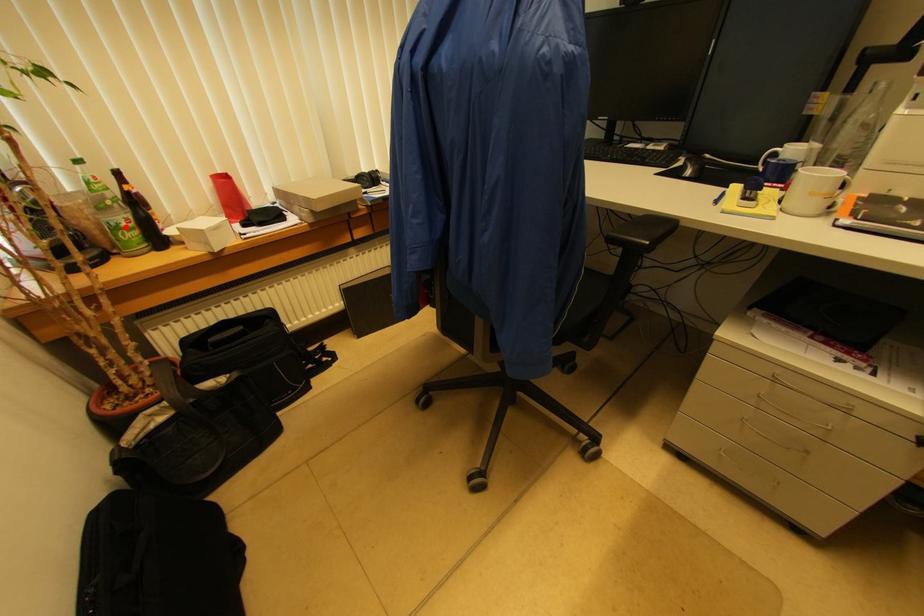
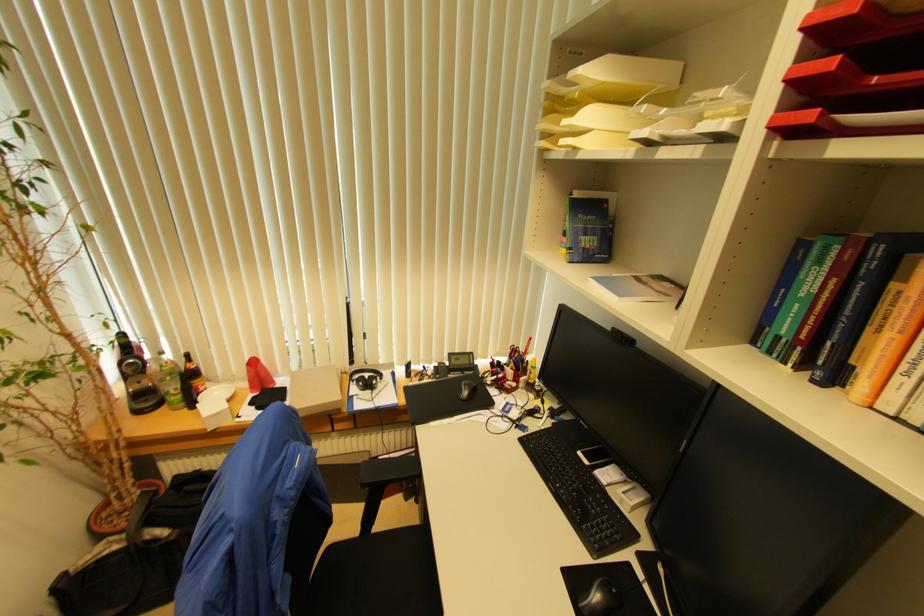
Question: I am providing you with two images of the same scene from different viewpoints. A red point is marked on the first image. Is the red point's position out of view in image 2?

Choices:
 (A) Yes
 (B) No

Answer: (B)